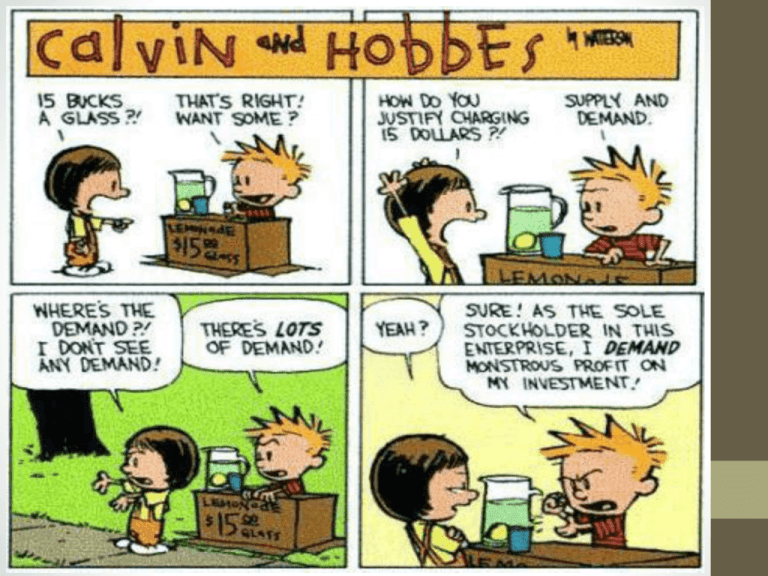
Locate an element on the screen. The height and width of the screenshot is (576, 768). frames is located at coordinates (154, 158), (391, 170), (186, 416), (459, 391).